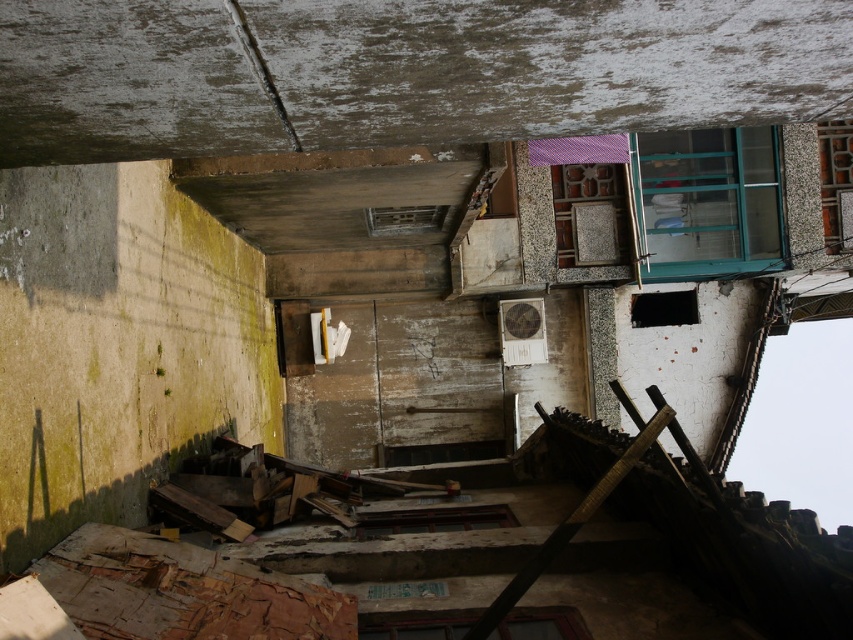
Question: Is green glass window at upper right further to camera compared to brown wooden window at lower center?

Choices:
 (A) no
 (B) yes

Answer: (B)

Question: Is green glass window at upper right thinner than brown wooden window at lower center?

Choices:
 (A) yes
 (B) no

Answer: (B)

Question: Is green glass window at upper right positioned behind brown wooden window at lower center?

Choices:
 (A) no
 (B) yes

Answer: (B)

Question: Among these points, which one is nearest to the camera?

Choices:
 (A) (718, 224)
 (B) (387, 612)

Answer: (B)